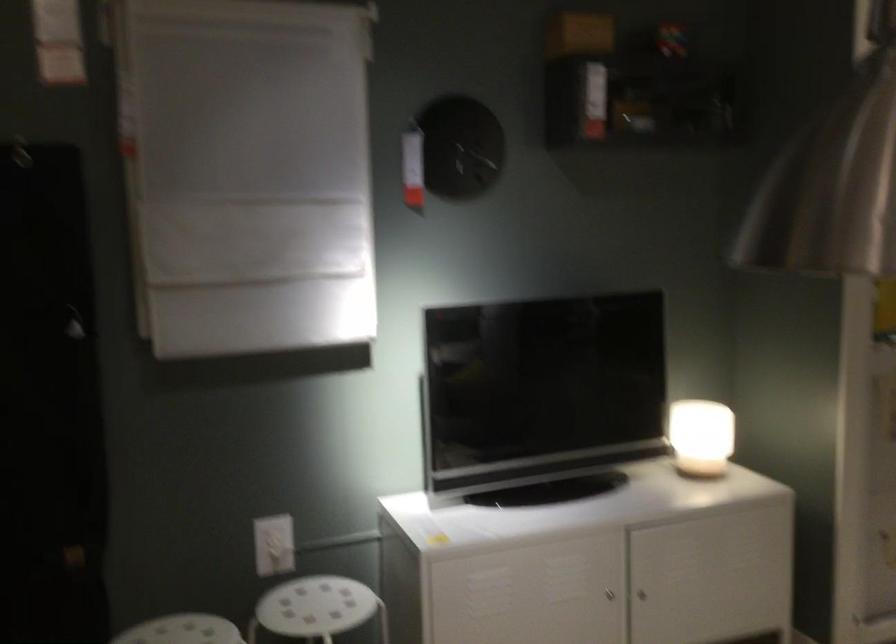
This screenshot has height=644, width=896. Identify the location of white wall outlet. (273, 545).